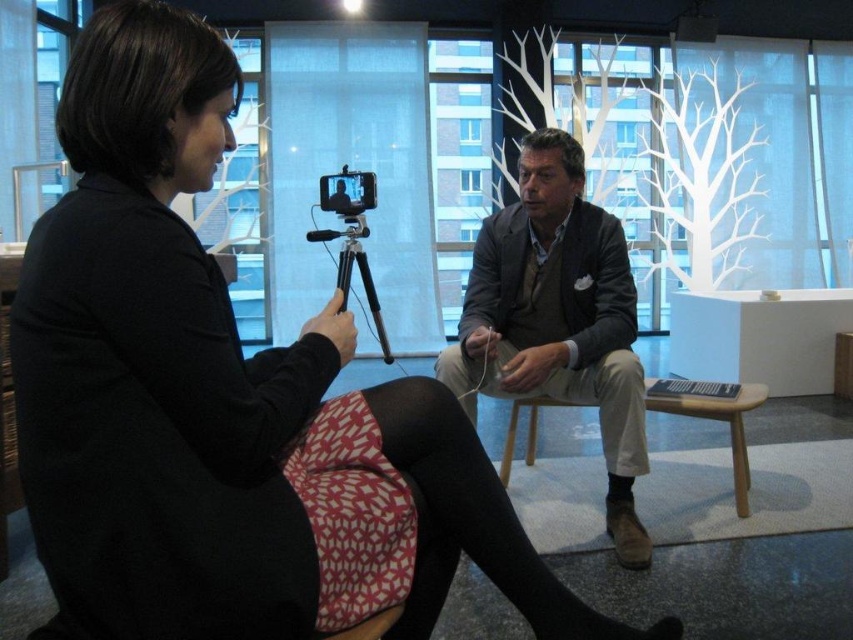
You are a photographer trying to capture a closeup shot of the interview setup. You notice two specific points in the scene at coordinates point [550,177] and point [347,186]. Which of these points is positioned closer to your camera lens?

Point [550,177] is closer to the camera than point [347,186].